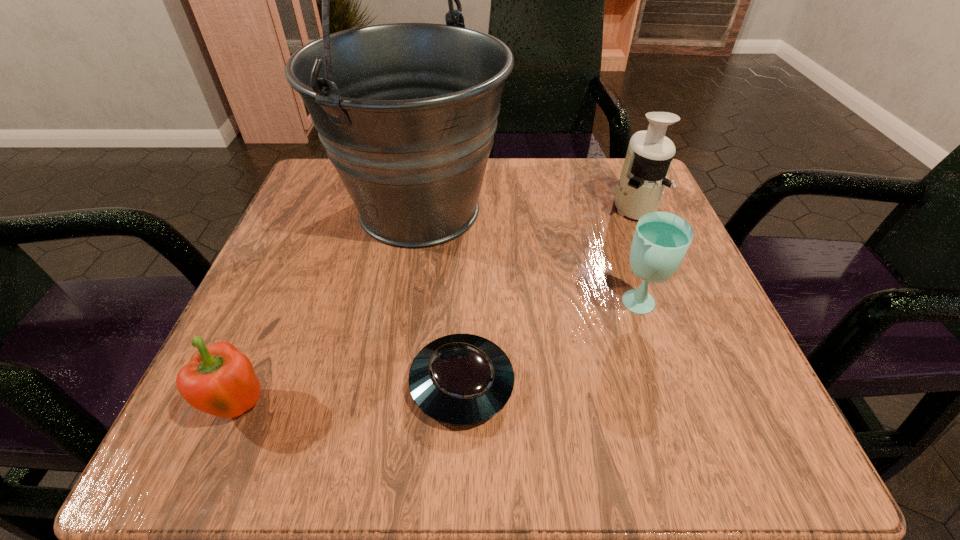
The width and height of the screenshot is (960, 540). Identify the location of bucket. (407, 112).

Locate an element on the screen. This screenshot has width=960, height=540. juicer is located at coordinates (643, 178).

At what (x,y) coordinates should I click in order to perform the action: click on the third farthest object. Please return your answer as a coordinate pair (x, y). Image resolution: width=960 pixels, height=540 pixels. Looking at the image, I should click on (661, 240).

Find the location of a particular element. This screenshot has width=960, height=540. glass is located at coordinates (661, 240).

I want to click on the fourth tallest object, so [219, 380].

Identify the location of saucer. (460, 379).

The height and width of the screenshot is (540, 960). I want to click on vacant space located on the left of the tallest object, so click(x=307, y=210).

Identify the location of free point located on the left of the second tallest object. (548, 206).

This screenshot has height=540, width=960. Find the location of `vacant space located 0.050m on the back of the glass`. vacant space located 0.050m on the back of the glass is located at coordinates (624, 268).

Identify the location of free location located 0.250m on the right of the pepper. (463, 406).